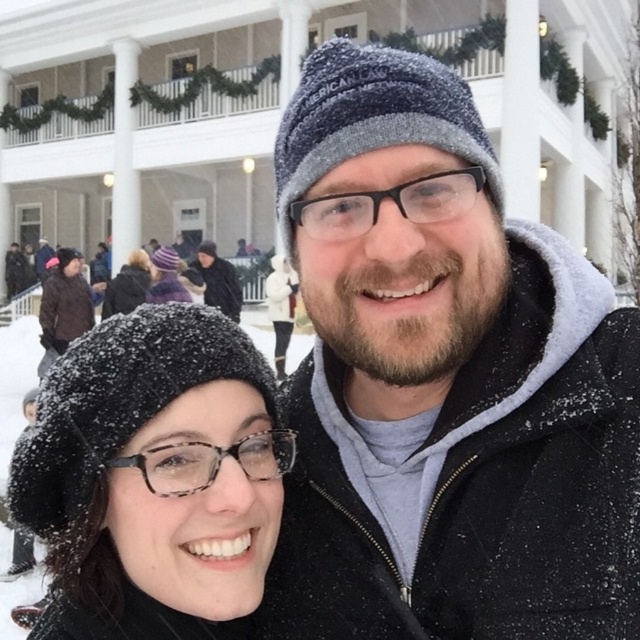
Is knitted wool hat at center to the right of black fuzzy hat at upper left from the viewer's perspective?

Yes, knitted wool hat at center is to the right of black fuzzy hat at upper left.

This screenshot has width=640, height=640. What are the coordinates of `knitted wool hat at center` in the screenshot? It's located at (444, 381).

Is knitted wool hat at center to the right of black knitted beret at lower left from the viewer's perspective?

Correct, you'll find knitted wool hat at center to the right of black knitted beret at lower left.

Describe the element at coordinates (444, 381) in the screenshot. I see `knitted wool hat at center` at that location.

Identify the location of knitted wool hat at center. (444, 381).

From the picture: Does black knitted beret at lower left appear under dark gray knit hat at center?

Indeed, black knitted beret at lower left is positioned under dark gray knit hat at center.

The height and width of the screenshot is (640, 640). What do you see at coordinates (154, 472) in the screenshot?
I see `black knitted beret at lower left` at bounding box center [154, 472].

Is point (109, 509) more distant than point (237, 291)?

No, it is not.

I want to click on black knitted beret at lower left, so click(154, 472).